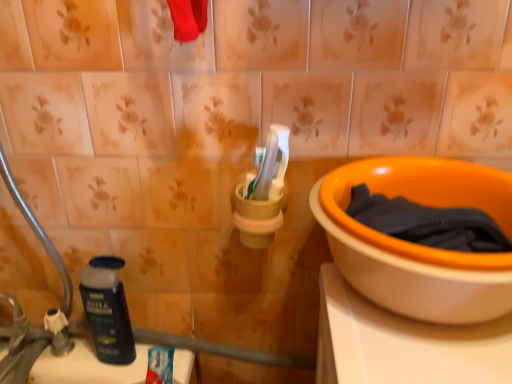
The image size is (512, 384). Describe the element at coordinates (33, 341) in the screenshot. I see `silver metallic faucet at lower left` at that location.

What is the approximate width of silver metallic faucet at lower left?

silver metallic faucet at lower left is 7.82 inches wide.

The height and width of the screenshot is (384, 512). Describe the element at coordinates (106, 310) in the screenshot. I see `dark blue plastic bottle at lower left` at that location.

What is the approximate width of dark blue plastic bottle at lower left?

dark blue plastic bottle at lower left is 4.07 inches in width.

Locate an element on the screen. silver metallic faucet at lower left is located at coordinates (33, 341).

Is orange ceramic bowl at right outside of dark blue fabric at right?

Yes, orange ceramic bowl at right is located beyond the bounds of dark blue fabric at right.

In the scene shown: How many degrees apart are the facing directions of orange ceramic bowl at right and dark blue fabric at right?

orange ceramic bowl at right and dark blue fabric at right are facing 0.000352 degrees away from each other.

Which is nearer, [433,175] or [418,222]?

Point [418,222]

Considering the relative positions of orange ceramic bowl at right and dark blue fabric at right in the image provided, is orange ceramic bowl at right to the right of dark blue fabric at right from the viewer's perspective?

Yes, orange ceramic bowl at right is to the right of dark blue fabric at right.

Consider the image. Visually, is silver metallic faucet at lower left positioned to the left or to the right of orange ceramic bowl at right?

From the image, it's evident that silver metallic faucet at lower left is to the left of orange ceramic bowl at right.

Based on the photo, between silver metallic faucet at lower left and orange ceramic bowl at right, which one has smaller size?

With smaller size is silver metallic faucet at lower left.

From the image's perspective, is silver metallic faucet at lower left located beneath orange ceramic bowl at right?

Yes, from the image's perspective, silver metallic faucet at lower left is below orange ceramic bowl at right.

Which is behind, point (52, 334) or point (448, 310)?

The point (52, 334) is farther from the camera.

Which is behind, point (87, 290) or point (446, 241)?

The point (87, 290) is behind.

Consider the image. From the image's perspective, between dark blue plastic bottle at lower left and dark blue fabric at right, which one is located above?

dark blue fabric at right appears higher in the image.

Which of these two, dark blue plastic bottle at lower left or dark blue fabric at right, stands shorter?

dark blue fabric at right.

Is silver metallic faucet at lower left placed right next to dark blue plastic bottle at lower left?

No, silver metallic faucet at lower left is not beside dark blue plastic bottle at lower left.

Which is behind, silver metallic faucet at lower left or dark blue plastic bottle at lower left?

dark blue plastic bottle at lower left is more distant.

Is dark blue fabric at right oriented away from dark blue plastic bottle at lower left?

That's not correct — dark blue fabric at right is not looking away from dark blue plastic bottle at lower left.

Choose the correct answer: Is dark blue fabric at right inside dark blue plastic bottle at lower left or outside it?

dark blue fabric at right cannot be found inside dark blue plastic bottle at lower left.

Looking at this image, is dark blue fabric at right smaller than dark blue plastic bottle at lower left?

Actually, dark blue fabric at right might be larger than dark blue plastic bottle at lower left.

In terms of width, does dark blue fabric at right look wider or thinner when compared to dark blue plastic bottle at lower left?

dark blue fabric at right is wider than dark blue plastic bottle at lower left.

This screenshot has height=384, width=512. I want to click on faucet on the left of the dark blue fabric at right, so click(33, 341).

Is silver metallic faucet at lower left oriented towards dark blue fabric at right?

No, silver metallic faucet at lower left is not facing towards dark blue fabric at right.

Considering the relative positions of silver metallic faucet at lower left and dark blue fabric at right in the image provided, is silver metallic faucet at lower left to the left or to the right of dark blue fabric at right?

From the image, it's evident that silver metallic faucet at lower left is to the left of dark blue fabric at right.

Can you confirm if dark blue fabric at right is positioned to the left of orange ceramic bowl at right?

Yes, dark blue fabric at right is to the left of orange ceramic bowl at right.

In the image, is dark blue fabric at right positioned in front of or behind orange ceramic bowl at right?

dark blue fabric at right is behind orange ceramic bowl at right.

Is dark blue fabric at right placed right next to orange ceramic bowl at right?

Yes, dark blue fabric at right is right next to orange ceramic bowl at right and making contact.

Is dark blue fabric at right looking in the opposite direction of orange ceramic bowl at right?

Yes.

I want to click on toilet in front of the dark blue fabric at right, so click(416, 244).

Find the location of a particular element. This screenshot has width=512, height=384. faucet behind the orange ceramic bowl at right is located at coordinates (33, 341).

Consider the image. Which object lies further to the anchor point silver metallic faucet at lower left, dark blue plastic bottle at lower left or dark blue fabric at right?

dark blue fabric at right is positioned further to the anchor silver metallic faucet at lower left.

From the image, which object appears to be nearer to dark blue fabric at right, silver metallic faucet at lower left or orange ceramic bowl at right?

orange ceramic bowl at right is positioned closer to the anchor dark blue fabric at right.

Estimate the real-world distances between objects in this image. Which object is further from orange ceramic bowl at right, dark blue plastic bottle at lower left or dark blue fabric at right?

Among the two, dark blue plastic bottle at lower left is located further to orange ceramic bowl at right.

Looking at the image, which one is located further to orange ceramic bowl at right, silver metallic faucet at lower left or dark blue fabric at right?

silver metallic faucet at lower left is positioned further to the anchor orange ceramic bowl at right.

Looking at the image, which one is located closer to silver metallic faucet at lower left, dark blue fabric at right or orange ceramic bowl at right?

orange ceramic bowl at right lies closer to silver metallic faucet at lower left than the other object.

Which object lies further to the anchor point orange ceramic bowl at right, dark blue fabric at right or dark blue plastic bottle at lower left?

dark blue plastic bottle at lower left is further to orange ceramic bowl at right.

Which object lies further to the anchor point dark blue plastic bottle at lower left, dark blue fabric at right or orange ceramic bowl at right?

dark blue fabric at right lies further to dark blue plastic bottle at lower left than the other object.

Estimate the real-world distances between objects in this image. Which object is closer to dark blue fabric at right, orange ceramic bowl at right or dark blue plastic bottle at lower left?

orange ceramic bowl at right lies closer to dark blue fabric at right than the other object.

Image resolution: width=512 pixels, height=384 pixels. What are the coordinates of `bottle located between silver metallic faucet at lower left and orange ceramic bowl at right in the left-right direction` in the screenshot? It's located at (106, 310).

At what (x,y) coordinates should I click in order to perform the action: click on bath towel between silver metallic faucet at lower left and orange ceramic bowl at right in the horizontal direction. Please return your answer as a coordinate pair (x, y). Looking at the image, I should click on (428, 223).

Find the location of a particular element. The width and height of the screenshot is (512, 384). bath towel situated between dark blue plastic bottle at lower left and orange ceramic bowl at right from left to right is located at coordinates (428, 223).

Where is `bottle located between silver metallic faucet at lower left and dark blue fabric at right in the left-right direction`? The width and height of the screenshot is (512, 384). bottle located between silver metallic faucet at lower left and dark blue fabric at right in the left-right direction is located at coordinates (106, 310).